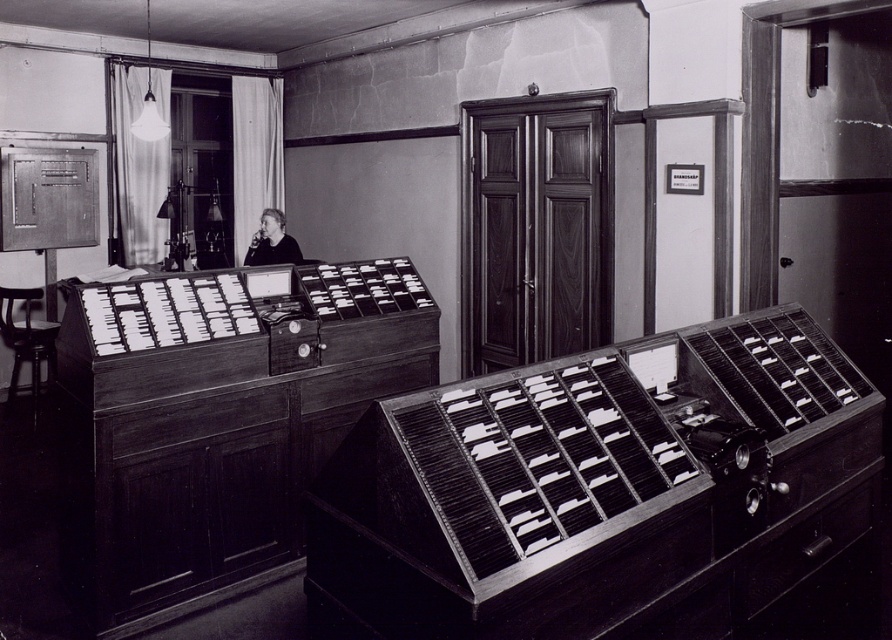
You are an office worker who needs to retrieve a file from the metallic drawer at lower right. You are currently standing 5 feet away from it. Can you reach the drawer without moving closer?

The metallic drawer at lower right is 7.45 feet away from the viewer. Since you are currently 5 feet away, you are already closer than the stated distance, so you can reach it without needing to move closer.

You are an office worker in the vintage office setting. You need to retrieve a document from the metallic drawer at lower right. Based on its location, can you estimate how far it is from the edge of the desk?

The metallic drawer at lower right is located at point (x=802, y=548), which means it is very close to the lower right edge of the desk. Therefore, it is only a short distance away from the edge.